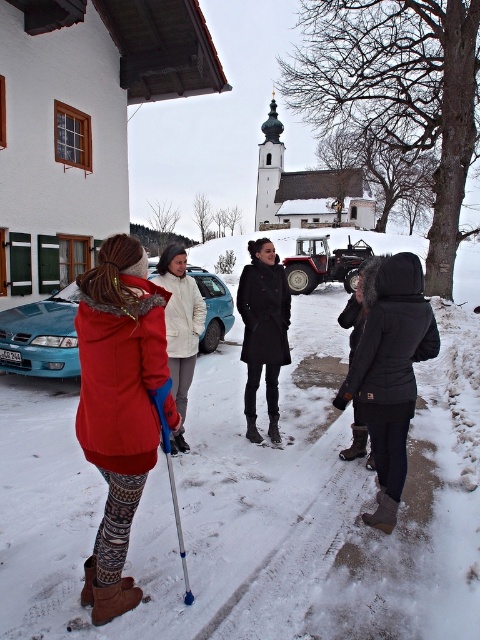
Between red fleece jacket at lower left and black synthetic jacket at lower right, which one appears on the left side from the viewer's perspective?

From the viewer's perspective, red fleece jacket at lower left appears more on the left side.

Can you confirm if red fleece jacket at lower left is positioned above black synthetic jacket at lower right?

No.

Is point (149, 433) less distant than point (387, 461)?

Yes, point (149, 433) is closer to viewer.

Find the location of a particular element. Image resolution: width=480 pixels, height=640 pixels. red fleece jacket at lower left is located at coordinates (118, 404).

Based on the photo, is black matte coat at center bigger than metallic blue ski pole at lower center?

Correct, black matte coat at center is larger in size than metallic blue ski pole at lower center.

Is black matte coat at center positioned before metallic blue ski pole at lower center?

No, it is not.

Locate an element on the screen. This screenshot has width=480, height=640. black matte coat at center is located at coordinates (264, 330).

Image resolution: width=480 pixels, height=640 pixels. Describe the element at coordinates (118, 404) in the screenshot. I see `red fleece jacket at lower left` at that location.

Is point (134, 291) farther from camera compared to point (202, 330)?

No, it is not.

Locate an element on the screen. red fleece jacket at lower left is located at coordinates (118, 404).